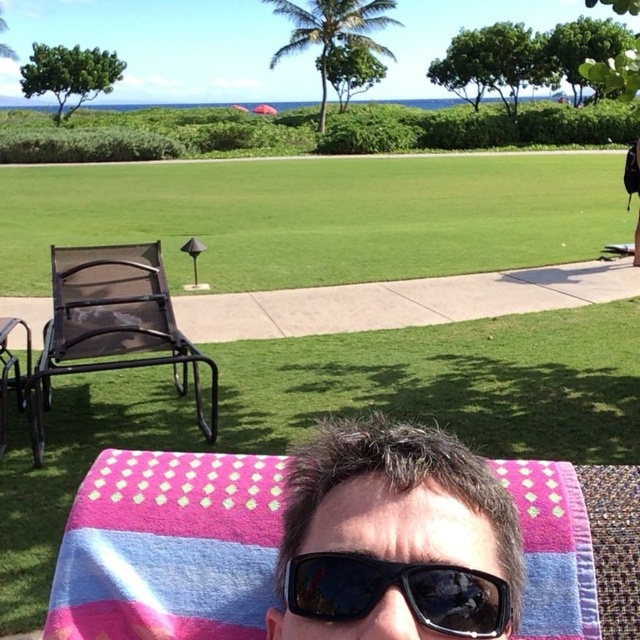
Question: Which point is closer to the camera?

Choices:
 (A) black matte sunglasses at center
 (B) green grass at center
 (C) black mesh chair at left

Answer: (A)

Question: Does matte black lounge chair at left appear on the left side of black reflective sunglasses at center?

Choices:
 (A) yes
 (B) no

Answer: (A)

Question: Is matte black lounge chair at left smaller than black reflective sunglasses at center?

Choices:
 (A) yes
 (B) no

Answer: (B)

Question: Which object is farther from the camera taking this photo?

Choices:
 (A) pink woven towel at lower center
 (B) black mesh chair at left
 (C) matte black lounge chair at left
 (D) black reflective sunglasses at center

Answer: (B)

Question: Considering the relative positions of green grass at center and black matte sunglasses at center in the image provided, where is green grass at center located with respect to black matte sunglasses at center?

Choices:
 (A) right
 (B) left

Answer: (B)

Question: Among these points, which one is farthest from the camera?

Choices:
 (A) (573, 252)
 (B) (3, 410)
 (C) (304, 508)
 (D) (97, 561)

Answer: (A)